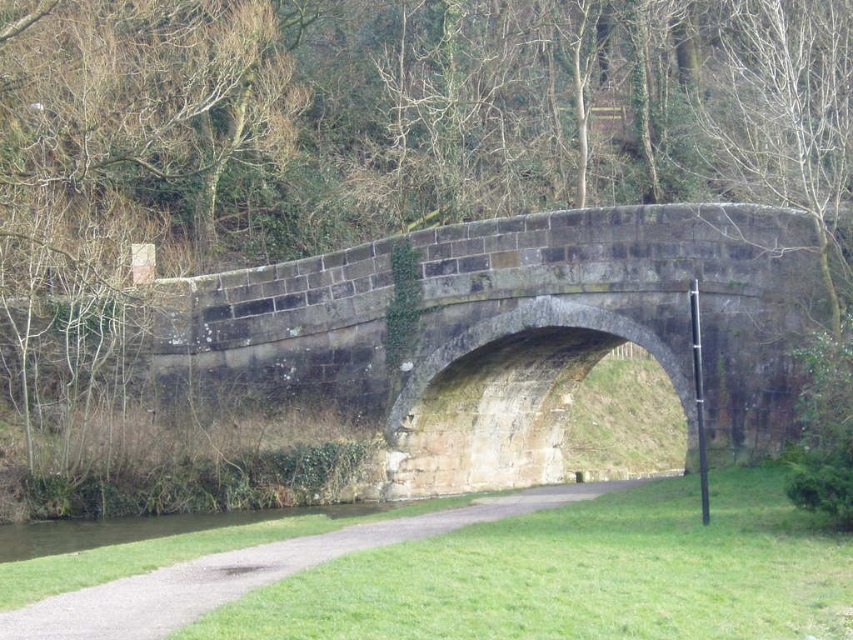
You are a hiker carrying a heavy backpack and need to cross the stone bridge. You see the gravel path at center and the green grassy water at lower left. Which path is closer to you for a safe crossing?

The gravel path at center is closer to you than the green grassy water at lower left, as they are 8.97 meters apart, so the gravel path at center is the safer option for crossing.

You are standing on the gravel path at center and want to cross to the other side of the waterway. To do so, you need to walk towards the dark gray stone bridge at center. Which direction should you move relative to your current position?

Since the dark gray stone bridge at center is further to the viewer than the gravel path at center, you should move forward towards the bridge to reach the other side of the waterway.

You are standing at the center of the image. Which direction should you move to get closer to the dark gray stone bridge at center?

Since the dark gray stone bridge at center is already at the center of the image, you don not need to move in any direction to get closer to it. You are already at the optimal position.